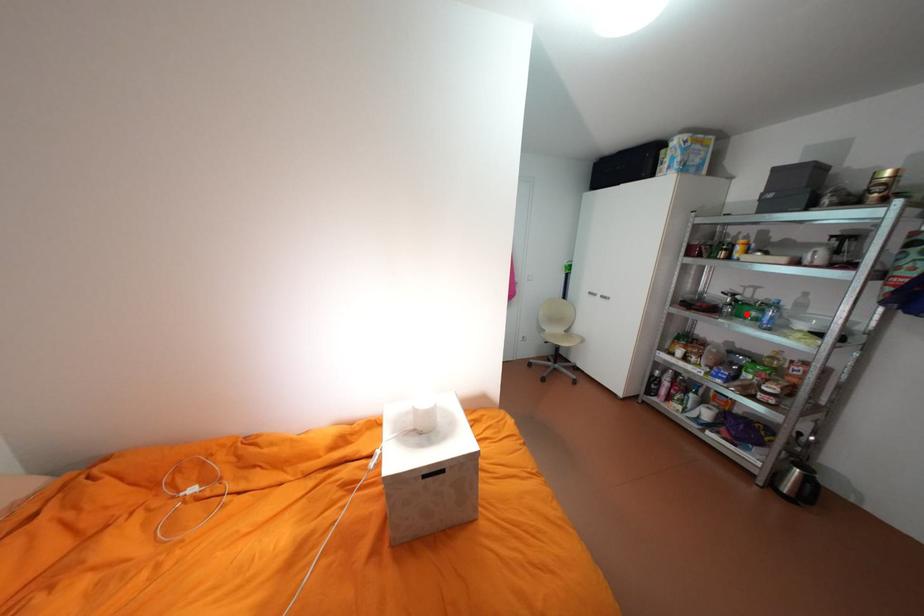
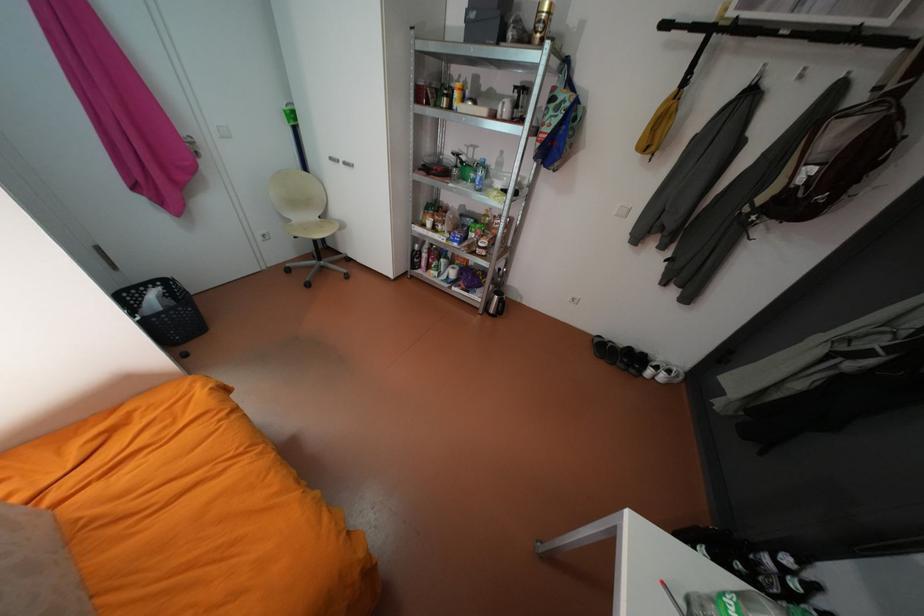
Question: I am providing you with two images of the same scene from different viewpoints. A red point is shown in image1. For the corresponding object point in image2, is it positioned nearer or farther from the camera?

Choices:
 (A) Nearer
 (B) Farther

Answer: (A)